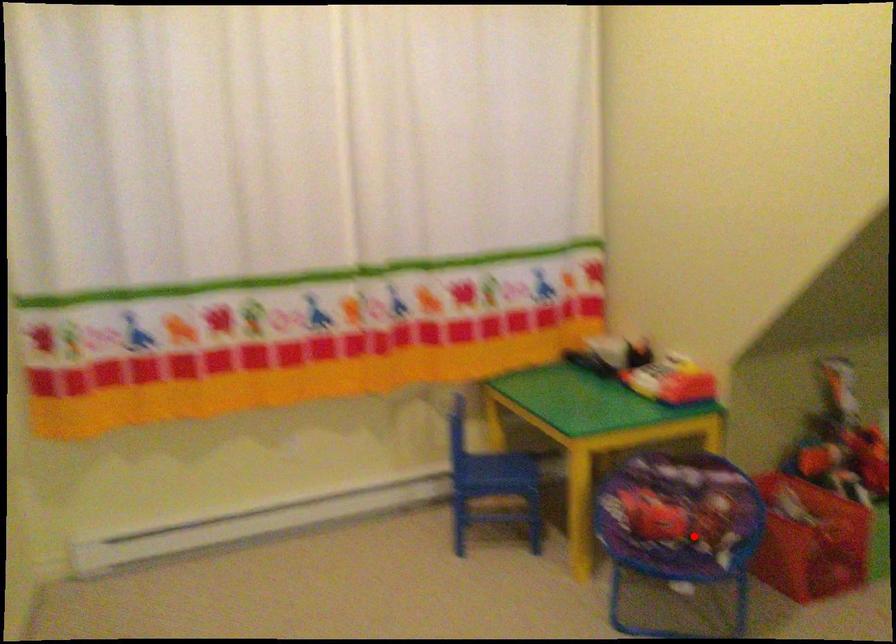
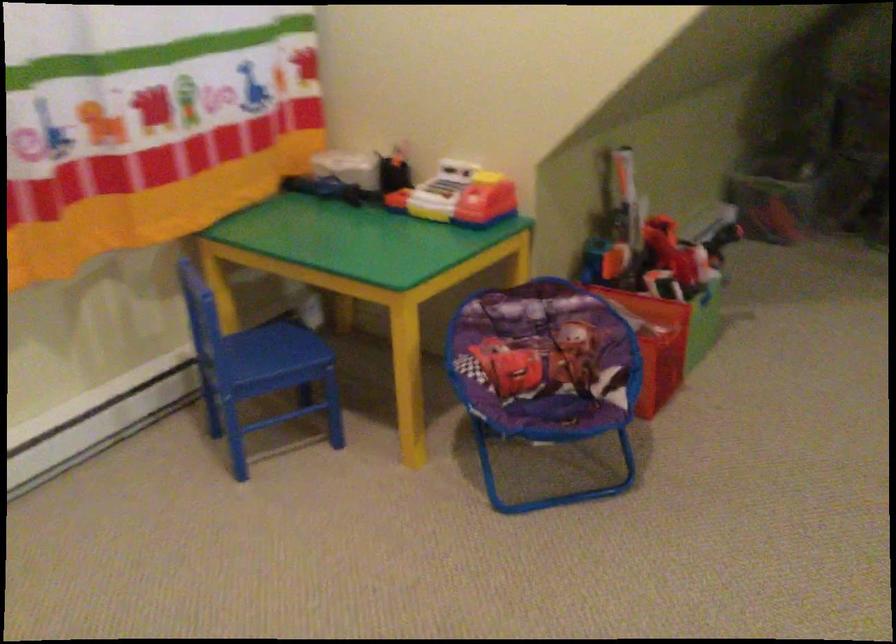
Locate, in the second image, the point that corresponds to the highlighted location in the first image.

(546, 372)